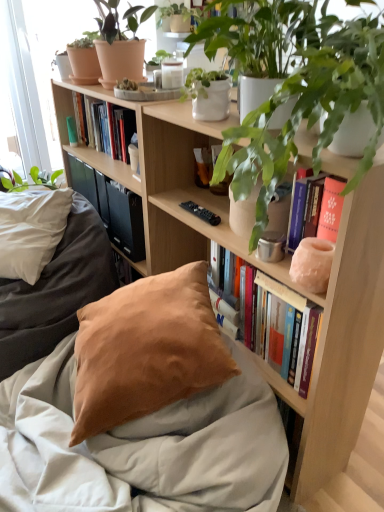
Question: Should I look upward or downward to see suede pillow at lower left?

Choices:
 (A) up
 (B) down

Answer: (B)

Question: Is the depth of hardcover books at upper center, which ranks as the 1th book in top-to-bottom order, greater than that of satin beige pillow at lower center?

Choices:
 (A) yes
 (B) no

Answer: (A)

Question: Is hardcover books at upper center, which ranks as the 1th book in top-to-bottom order, in front of satin beige pillow at lower center?

Choices:
 (A) yes
 (B) no

Answer: (B)

Question: From a real-world perspective, is hardcover books at upper center, which is the 1th book from left to right, over satin beige pillow at lower center?

Choices:
 (A) no
 (B) yes

Answer: (B)

Question: Could you tell me if hardcover books at upper center, placed as the first book when sorted from back to front, is turned towards satin beige pillow at lower center?

Choices:
 (A) yes
 (B) no

Answer: (B)

Question: Considering the relative sizes of hardcover books at upper center, marked as the second book in a front-to-back arrangement, and satin beige pillow at lower center in the image provided, is hardcover books at upper center, marked as the second book in a front-to-back arrangement, thinner than satin beige pillow at lower center?

Choices:
 (A) yes
 (B) no

Answer: (A)

Question: Is hardcover books at upper center, placed as the first book when sorted from back to front, at the left side of satin beige pillow at lower center?

Choices:
 (A) no
 (B) yes

Answer: (B)

Question: Considering the relative sizes of green matte plant at upper right, which is the second houseplant from top to bottom, and matte pink stone vase at upper right, the 1th book positioned from the front, in the image provided, is green matte plant at upper right, which is the second houseplant from top to bottom, taller than matte pink stone vase at upper right, the 1th book positioned from the front,?

Choices:
 (A) no
 (B) yes

Answer: (A)

Question: From the image's perspective, is green matte plant at upper right, which appears as the second houseplant when viewed from the left, below matte pink stone vase at upper right, marked as the second book in a top-to-bottom arrangement?

Choices:
 (A) no
 (B) yes

Answer: (A)

Question: Is green matte plant at upper right, the 1th houseplant positioned from the right, smaller than matte pink stone vase at upper right, the 1th book positioned from the front?

Choices:
 (A) no
 (B) yes

Answer: (A)

Question: Is green matte plant at upper right, which is the first houseplant from bottom to top, positioned far away from matte pink stone vase at upper right, marked as the second book in a top-to-bottom arrangement?

Choices:
 (A) no
 (B) yes

Answer: (A)

Question: Can matte pink stone vase at upper right, the 1th book positioned from the front, be found inside green matte plant at upper right, which is the 2th houseplant from back to front?

Choices:
 (A) yes
 (B) no

Answer: (B)

Question: Is green matte plant at upper right, which appears as the second houseplant when viewed from the left, looking in the opposite direction of matte pink stone vase at upper right, which is the 2th book in left-to-right order?

Choices:
 (A) no
 (B) yes

Answer: (A)

Question: Does hardcover books at upper center, which is the 2th book from bottom to top, have a smaller size compared to green matte plant at upper right, which appears as the second houseplant when viewed from the left?

Choices:
 (A) yes
 (B) no

Answer: (A)